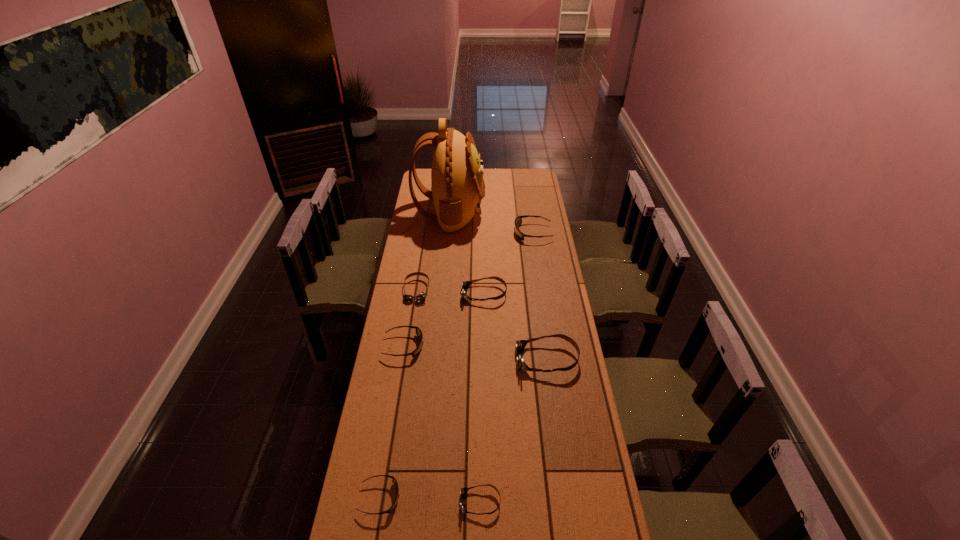
Identify the location of vacant space located 0.290m on the front-facing side of the third smallest brown goggles. The width and height of the screenshot is (960, 540). (400, 294).

Where is `vacant space situated 0.370m on the lenses of the second farthest black goggles`? Image resolution: width=960 pixels, height=540 pixels. vacant space situated 0.370m on the lenses of the second farthest black goggles is located at coordinates (513, 346).

Find the location of a particular element. This screenshot has width=960, height=540. vacant space positioned on the front-facing side of the leftmost brown goggles is located at coordinates (404, 372).

What are the coordinates of `free space located 0.130m on the lenses of the smallest black goggles` in the screenshot? It's located at (442, 498).

Identify the location of free space located on the front-facing side of the nearest brown goggles. click(425, 502).

Find the location of a particular element. This screenshot has height=540, width=960. free location located on the front-facing side of the nearest brown goggles is located at coordinates (396, 502).

I want to click on free space located on the front-facing side of the nearest brown goggles, so click(x=358, y=502).

Find the location of a particular element. backpack situated at the left edge is located at coordinates (458, 187).

At what (x,y) coordinates should I click in order to perform the action: click on blank space at the far edge. Please return your answer as a coordinate pair (x, y). The height and width of the screenshot is (540, 960). Looking at the image, I should click on (513, 181).

The width and height of the screenshot is (960, 540). I want to click on vacant space at the left edge of the desktop, so click(386, 397).